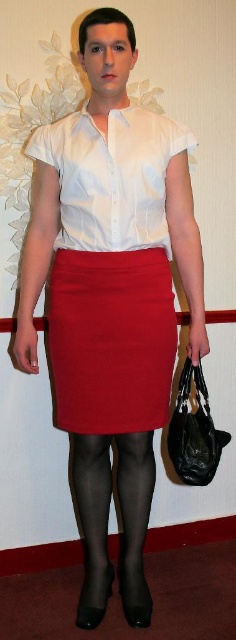
From the picture: You are a photographer setting up for a portrait. The subject is wearing a white glossy shirt at center and black sheer tights at lower center. To ensure the shirt is in sharp focus while slightly blurring the tights, which part should you focus on?

You should focus on the white glossy shirt at center because it is closer to the viewer than the black sheer tights at lower center, so focusing on it will keep the shirt sharp while the tights may appear slightly out of focus.

You are a fashion designer observing the outfit of the person in the image. Which item of clothing is smaller in size between the white glossy shirt at center and the black sheer tights at lower center?

The white glossy shirt at center is smaller than the black sheer tights at lower center according to the description.

You are a fashion designer trying to create a new outfit. You observe the image and notice the matte red skirt at center and the white glossy shirt at center. Which of these two items has a larger surface area?

The matte red skirt at center is bigger than the white glossy shirt at center, so the matte red skirt at center has a larger surface area.